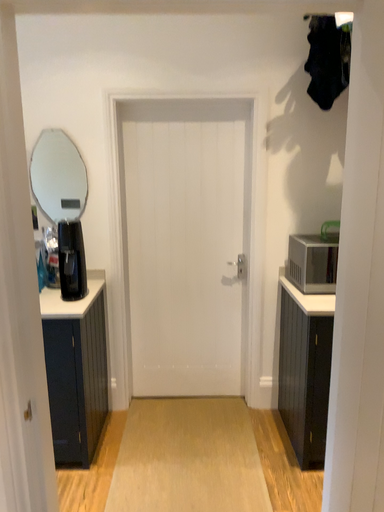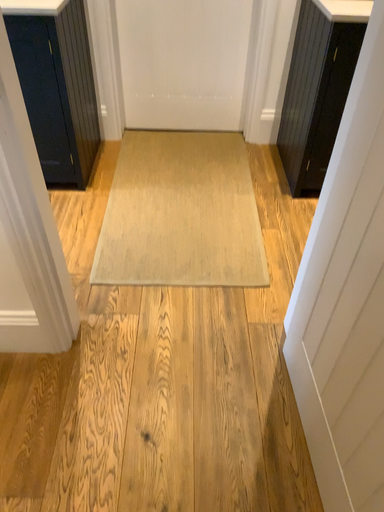
Question: Which way did the camera rotate in the video?

Choices:
 (A) rotated upward
 (B) rotated downward

Answer: (B)